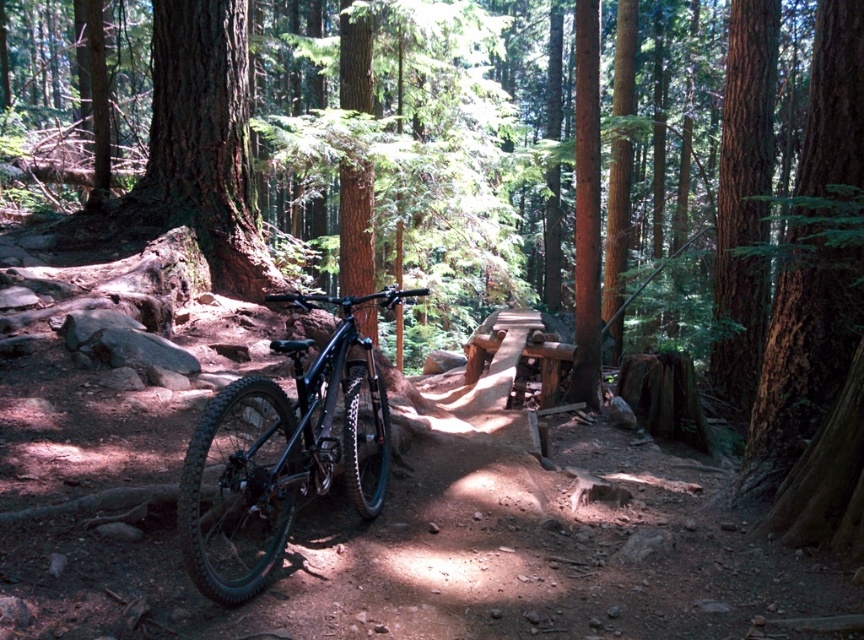
Question: Does shiny black mountain bike at center lie behind smooth brown bark at right?

Choices:
 (A) no
 (B) yes

Answer: (A)

Question: Which of the following is the closest to the observer?

Choices:
 (A) smooth brown bark at right
 (B) shiny black mountain bike at center

Answer: (B)

Question: Can you confirm if shiny black mountain bike at center is positioned to the right of smooth brown bark at right?

Choices:
 (A) no
 (B) yes

Answer: (A)

Question: Is shiny black mountain bike at center behind smooth brown bark at right?

Choices:
 (A) yes
 (B) no

Answer: (B)

Question: Which point is closer to the camera taking this photo?

Choices:
 (A) (835, 147)
 (B) (302, 413)

Answer: (B)